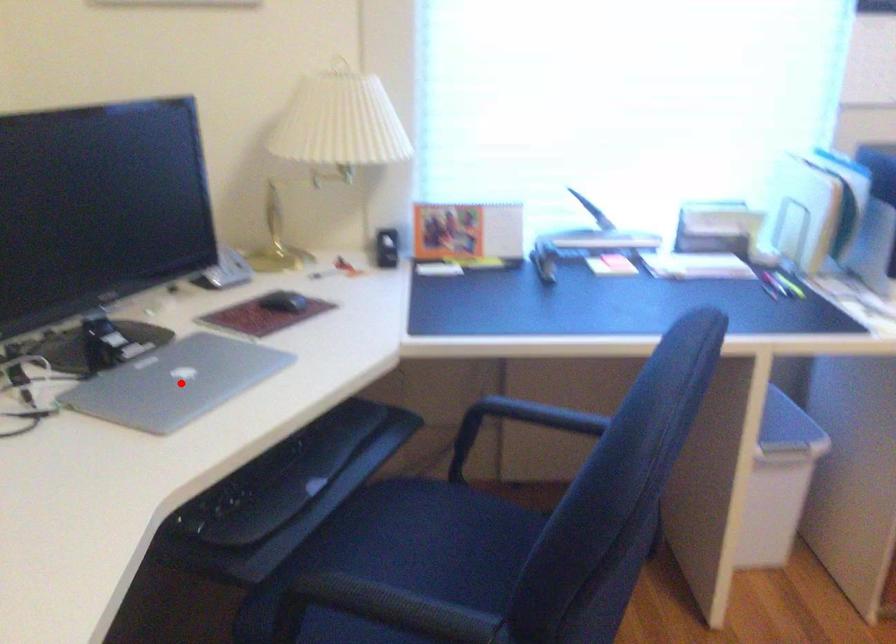
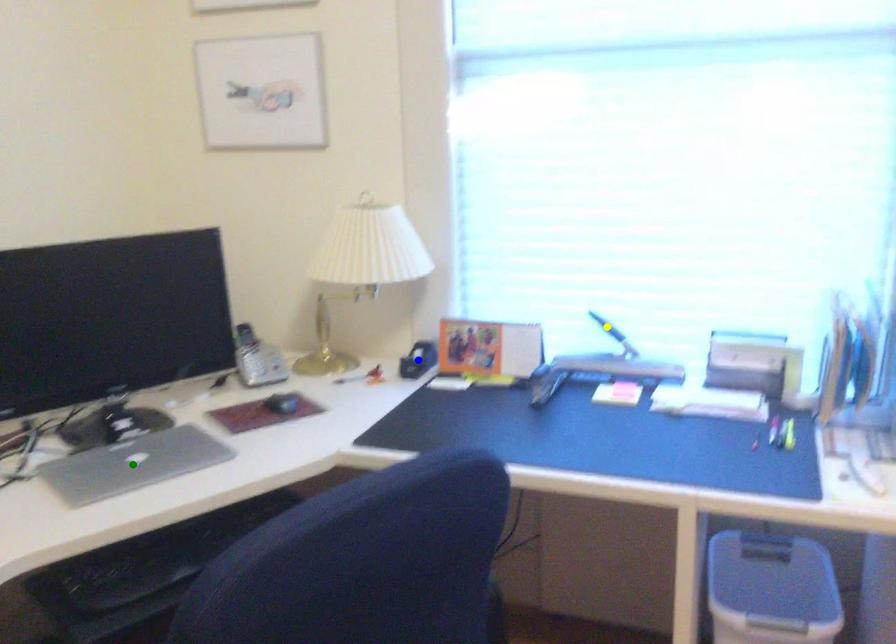
Question: I am providing you with two images of the same scene from different viewpoints. A red point is marked on the first image. You are given multiple points on the second image. Which point in image 2 represents the same 3d spot as the red point in image 1?

Choices:
 (A) blue point
 (B) yellow point
 (C) green point

Answer: (C)